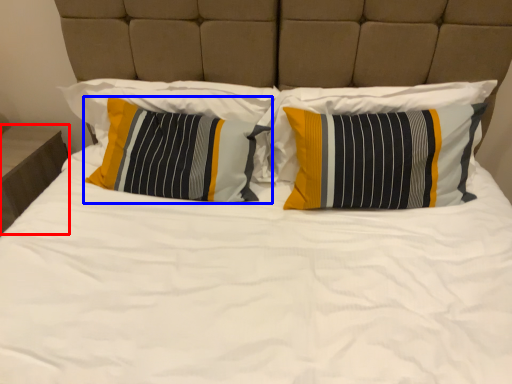
Question: Which of the following is the farthest to the observer, nightstand (highlighted by a red box) or pillow (highlighted by a blue box)?

Choices:
 (A) nightstand
 (B) pillow

Answer: (A)